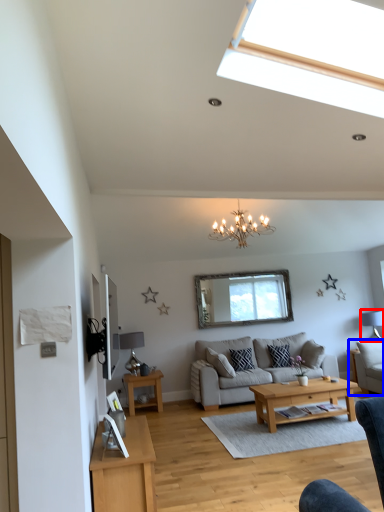
Question: Which object is further to the camera taking this photo, lamp (highlighted by a red box) or armchair (highlighted by a blue box)?

Choices:
 (A) lamp
 (B) armchair

Answer: (A)